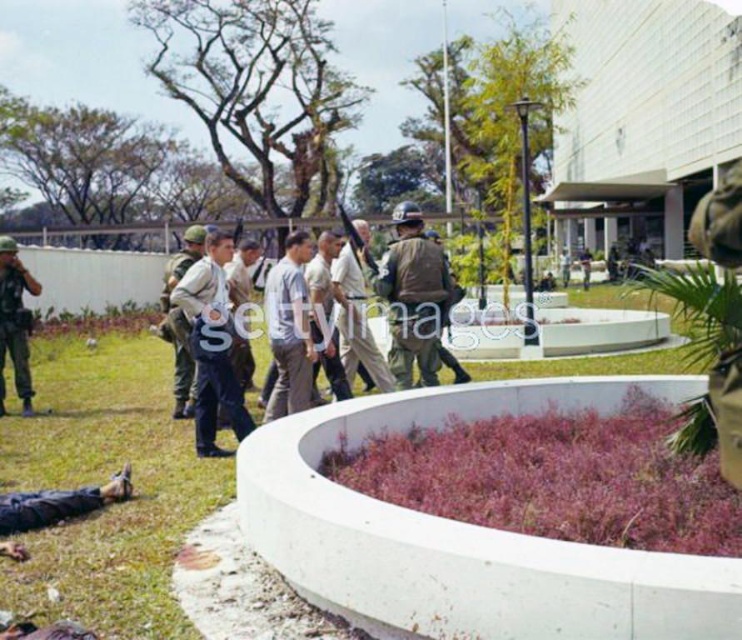
Can you confirm if light brown uniform at center is positioned to the right of camouflage uniform at center?

Correct, you'll find light brown uniform at center to the right of camouflage uniform at center.

Between point (217, 234) and point (180, 410), which one is positioned in front?

Point (217, 234) is more forward.

Which is in front, point (200, 403) or point (183, 346)?

Point (200, 403) is in front.

Find the location of a particular element. The width and height of the screenshot is (742, 640). light brown uniform at center is located at coordinates (211, 346).

Consider the image. Is light gray cotton shirt at center above khaki uniform at center?

No, light gray cotton shirt at center is not above khaki uniform at center.

Between point (282, 410) and point (364, 349), which one is positioned behind?

Positioned behind is point (364, 349).

At what (x,y) coordinates should I click in order to perform the action: click on light gray cotton shirt at center. Please return your answer as a coordinate pair (x, y). Looking at the image, I should click on (289, 330).

You are a GUI agent. You are given a task and a screenshot of the screen. Output one action in this format:
    pyautogui.click(x=<x>, y=<y>)
    Task: Click on the light gray cotton shirt at center
    This screenshot has width=742, height=640.
    Given the screenshot: What is the action you would take?
    pyautogui.click(x=289, y=330)

Does point (305, 328) come closer to viewer compared to point (200, 225)?

Yes.

Between light gray cotton shirt at center and camouflage uniform at center, which one is positioned lower?

camouflage uniform at center is lower down.

Is point (272, 323) more distant than point (180, 269)?

That is False.

This screenshot has height=640, width=742. What are the coordinates of `light gray cotton shirt at center` in the screenshot? It's located at (289, 330).